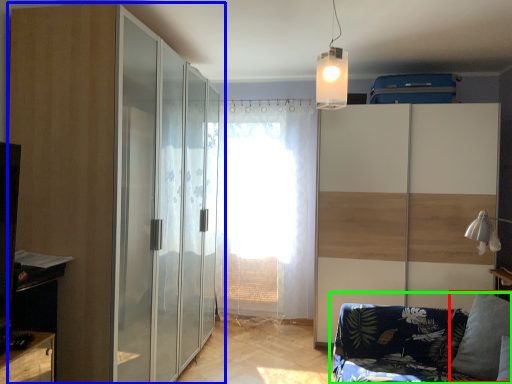
Question: Considering the real-world distances, which object is farthest from pillow (highlighted by a red box)? door (highlighted by a blue box) or studio couch (highlighted by a green box)?

Choices:
 (A) door
 (B) studio couch

Answer: (A)